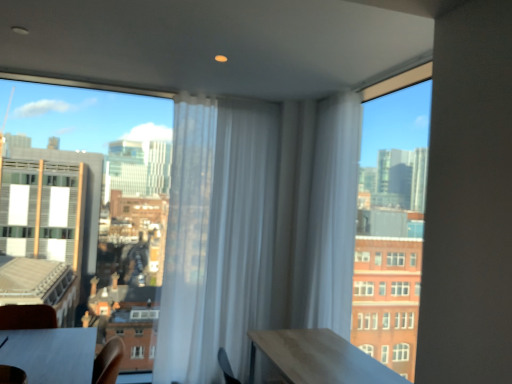
Question: Considering the relative positions of white sheer curtain at center, the 1th curtain when ordered from right to left, and white sheer curtain at center, the first curtain positioned from the left, in the image provided, is white sheer curtain at center, the 1th curtain when ordered from right to left, in front of white sheer curtain at center, the first curtain positioned from the left,?

Choices:
 (A) no
 (B) yes

Answer: (B)

Question: Considering the relative sizes of white sheer curtain at center, the 1th curtain when ordered from right to left, and white sheer curtain at center, the first curtain positioned from the left, in the image provided, is white sheer curtain at center, the 1th curtain when ordered from right to left, thinner than white sheer curtain at center, the first curtain positioned from the left,?

Choices:
 (A) no
 (B) yes

Answer: (A)

Question: Is white sheer curtain at center, the 1th curtain when ordered from right to left, further to the viewer compared to white sheer curtain at center, acting as the 2th curtain starting from the right?

Choices:
 (A) no
 (B) yes

Answer: (A)

Question: From the image's perspective, is white sheer curtain at center, the 1th curtain when ordered from right to left, located beneath white sheer curtain at center, the first curtain positioned from the left?

Choices:
 (A) no
 (B) yes

Answer: (A)

Question: Is white sheer curtain at center, the 1th curtain when ordered from right to left, to the left of white sheer curtain at center, the first curtain positioned from the left, from the viewer's perspective?

Choices:
 (A) yes
 (B) no

Answer: (B)

Question: From a real-world perspective, is white sheer curtain at center, the 1th curtain when ordered from right to left, positioned under white sheer curtain at center, acting as the 2th curtain starting from the right, based on gravity?

Choices:
 (A) no
 (B) yes

Answer: (A)

Question: From a real-world perspective, is smooth wooden table at lower left positioned under white sheer curtain at center, acting as the 2th curtain starting from the right, based on gravity?

Choices:
 (A) yes
 (B) no

Answer: (A)

Question: Does smooth wooden table at lower left have a lesser height compared to white sheer curtain at center, acting as the 2th curtain starting from the right?

Choices:
 (A) no
 (B) yes

Answer: (B)

Question: Is smooth wooden table at lower left thinner than white sheer curtain at center, acting as the 2th curtain starting from the right?

Choices:
 (A) yes
 (B) no

Answer: (B)

Question: Does smooth wooden table at lower left come in front of white sheer curtain at center, the first curtain positioned from the left?

Choices:
 (A) yes
 (B) no

Answer: (A)

Question: Can you confirm if smooth wooden table at lower left is bigger than white sheer curtain at center, the first curtain positioned from the left?

Choices:
 (A) yes
 (B) no

Answer: (B)

Question: From the image's perspective, does smooth wooden table at lower left appear higher than white sheer curtain at center, acting as the 2th curtain starting from the right?

Choices:
 (A) yes
 (B) no

Answer: (B)

Question: Does transparent glass window at upper left, placed as the second window when sorted from right to left, lie in front of white sheer curtain at center, acting as the 2th curtain starting from the right?

Choices:
 (A) yes
 (B) no

Answer: (A)